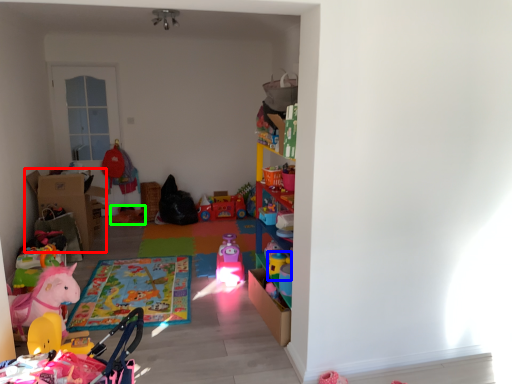
Question: Which object is the farthest from cardboard box (highlighted by a red box)? Choose among these: toy (highlighted by a blue box) or toy (highlighted by a green box).

Choices:
 (A) toy
 (B) toy

Answer: (A)